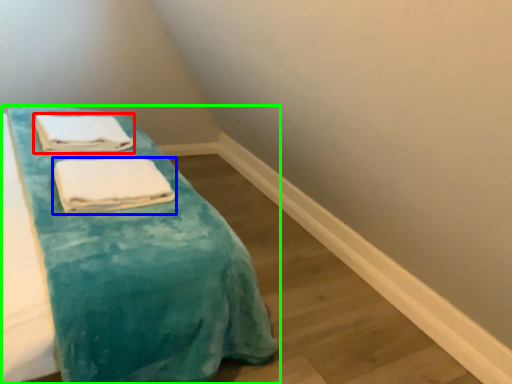
Question: Which object is positioned closest to towel (highlighted by a red box)? Select from towel (highlighted by a blue box) and furniture (highlighted by a green box).

Choices:
 (A) towel
 (B) furniture

Answer: (A)